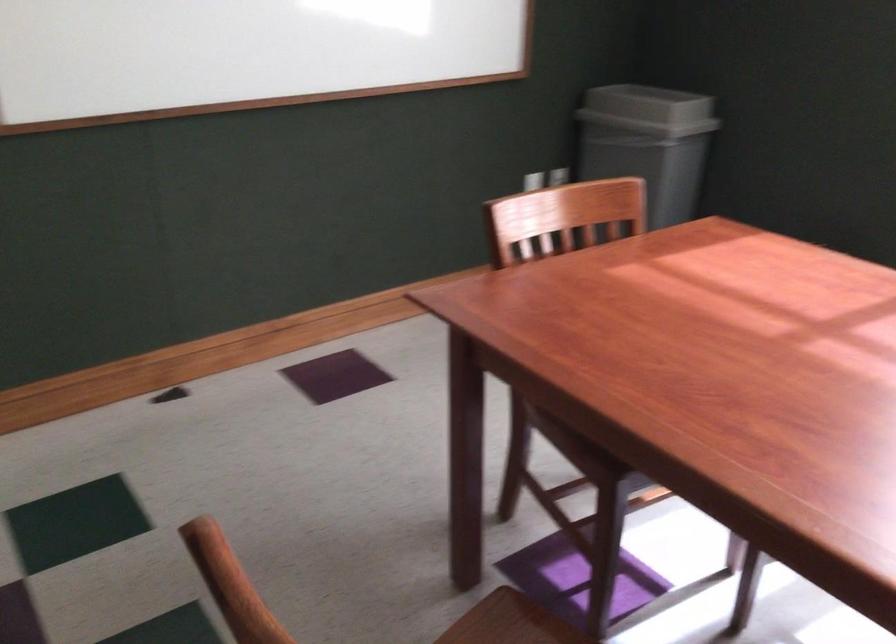
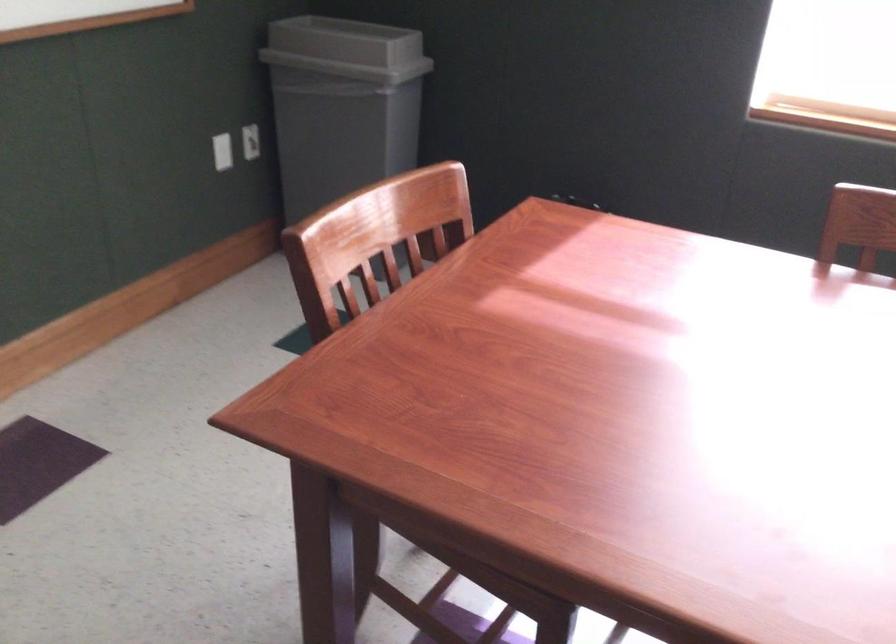
Question: The camera is either moving clockwise (left) or counter-clockwise (right) around the object. The first image is from the beginning of the video and the second image is from the end. Is the camera moving left or right when shooting the video?

Choices:
 (A) Left
 (B) Right

Answer: (A)